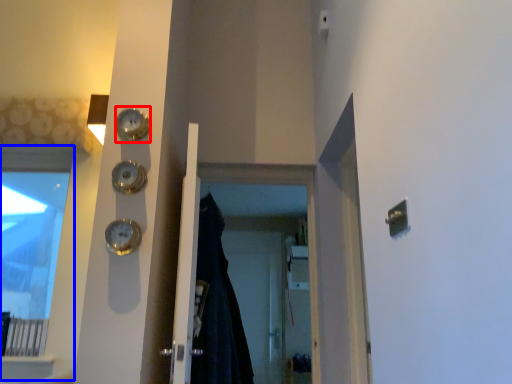
Question: Which object appears farthest to the camera in this image, clock (highlighted by a red box) or window (highlighted by a blue box)?

Choices:
 (A) clock
 (B) window

Answer: (B)